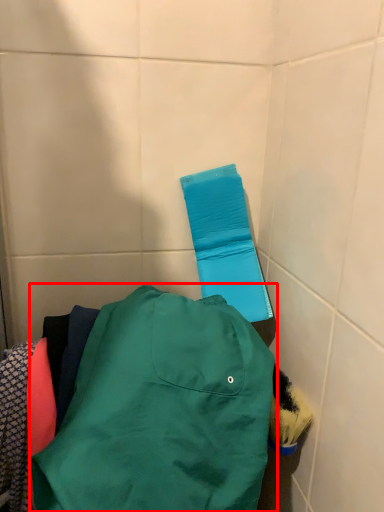
Question: In this image, where is jacket (annotated by the red box) located relative to towel bar?

Choices:
 (A) left
 (B) right

Answer: (A)